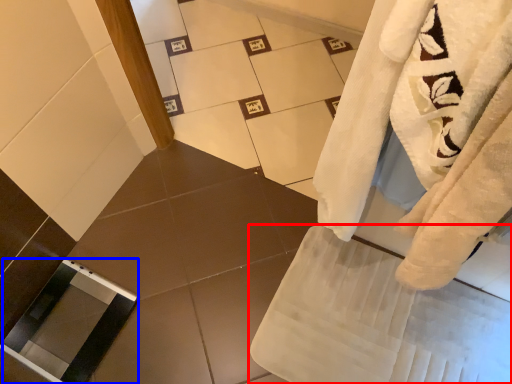
Question: Which of the following is the farthest to the observer, bath towel (highlighted by a red box) or screen door (highlighted by a blue box)?

Choices:
 (A) bath towel
 (B) screen door

Answer: (B)